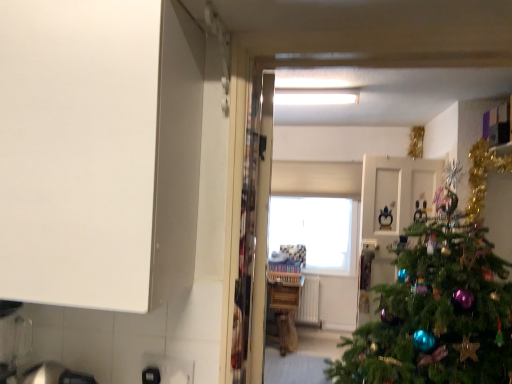
Question: Is transparent glass window at center thinner than wooden counter at center?

Choices:
 (A) no
 (B) yes

Answer: (B)

Question: Is transparent glass window at center wider than wooden counter at center?

Choices:
 (A) no
 (B) yes

Answer: (A)

Question: Can you confirm if transparent glass window at center is positioned to the left of wooden counter at center?

Choices:
 (A) no
 (B) yes

Answer: (A)

Question: From a real-world perspective, is transparent glass window at center located beneath wooden counter at center?

Choices:
 (A) yes
 (B) no

Answer: (B)

Question: Does transparent glass window at center have a smaller size compared to wooden counter at center?

Choices:
 (A) no
 (B) yes

Answer: (B)

Question: Can you see transparent glass window at center touching wooden counter at center?

Choices:
 (A) yes
 (B) no

Answer: (B)

Question: Does white glossy door at center lie in front of wooden counter at center?

Choices:
 (A) yes
 (B) no

Answer: (B)

Question: Is white glossy door at center oriented towards wooden counter at center?

Choices:
 (A) no
 (B) yes

Answer: (A)

Question: Can you confirm if white glossy door at center is taller than wooden counter at center?

Choices:
 (A) yes
 (B) no

Answer: (A)

Question: Would you say white glossy door at center is a long distance from wooden counter at center?

Choices:
 (A) yes
 (B) no

Answer: (A)

Question: Is white glossy door at center next to wooden counter at center?

Choices:
 (A) yes
 (B) no

Answer: (B)

Question: Is wooden counter at center located within white glossy door at center?

Choices:
 (A) yes
 (B) no

Answer: (B)

Question: Does transparent glass window at center have a greater width compared to white glossy door at center?

Choices:
 (A) no
 (B) yes

Answer: (A)